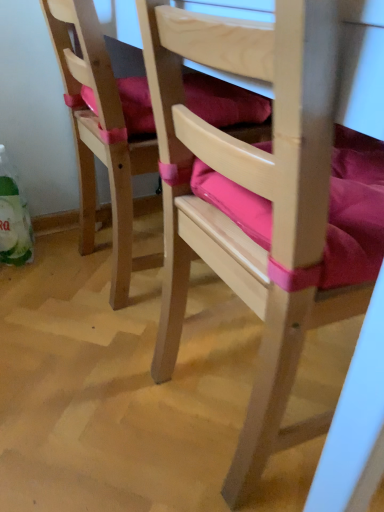
Question: Can you confirm if pink fabric cushion at left, which ranks as the second chair in right-to-left order, is smaller than wooden chair with pink cushion at center, arranged as the 1th chair when viewed from the right?

Choices:
 (A) yes
 (B) no

Answer: (A)

Question: Would you say wooden chair with pink cushion at center, arranged as the 1th chair when viewed from the right, is part of pink fabric cushion at left, which ranks as the second chair in right-to-left order,'s contents?

Choices:
 (A) yes
 (B) no

Answer: (B)

Question: Does pink fabric cushion at left, which ranks as the second chair in right-to-left order, have a lesser height compared to wooden chair with pink cushion at center, arranged as the 1th chair when viewed from the right?

Choices:
 (A) yes
 (B) no

Answer: (A)

Question: Does pink fabric cushion at left, which ranks as the second chair in right-to-left order, have a greater height compared to wooden chair with pink cushion at center, arranged as the 1th chair when viewed from the right?

Choices:
 (A) no
 (B) yes

Answer: (A)

Question: Considering the relative positions of pink fabric cushion at left, which is the 1th chair in left-to-right order, and wooden chair with pink cushion at center, arranged as the 1th chair when viewed from the right, in the image provided, is pink fabric cushion at left, which is the 1th chair in left-to-right order, behind wooden chair with pink cushion at center, arranged as the 1th chair when viewed from the right,?

Choices:
 (A) no
 (B) yes

Answer: (B)

Question: Is pink fabric cushion at left, which ranks as the second chair in right-to-left order, next to wooden chair with pink cushion at center, the second chair in the left-to-right sequence, and touching it?

Choices:
 (A) no
 (B) yes

Answer: (A)

Question: Is wooden chair with pink cushion at center, the second chair in the left-to-right sequence, aimed at pink fabric cushion at left, which ranks as the second chair in right-to-left order?

Choices:
 (A) yes
 (B) no

Answer: (B)

Question: Considering the relative sizes of wooden chair with pink cushion at center, the second chair in the left-to-right sequence, and pink fabric cushion at left, which ranks as the second chair in right-to-left order, in the image provided, is wooden chair with pink cushion at center, the second chair in the left-to-right sequence, taller than pink fabric cushion at left, which ranks as the second chair in right-to-left order,?

Choices:
 (A) yes
 (B) no

Answer: (A)

Question: From the image's perspective, is wooden chair with pink cushion at center, arranged as the 1th chair when viewed from the right, located beneath pink fabric cushion at left, which is the 1th chair in left-to-right order?

Choices:
 (A) yes
 (B) no

Answer: (A)

Question: Does wooden chair with pink cushion at center, the second chair in the left-to-right sequence, come in front of pink fabric cushion at left, which is the 1th chair in left-to-right order?

Choices:
 (A) yes
 (B) no

Answer: (A)

Question: Considering the relative sizes of wooden chair with pink cushion at center, the second chair in the left-to-right sequence, and pink fabric cushion at left, which is the 1th chair in left-to-right order, in the image provided, is wooden chair with pink cushion at center, the second chair in the left-to-right sequence, shorter than pink fabric cushion at left, which is the 1th chair in left-to-right order,?

Choices:
 (A) yes
 (B) no

Answer: (B)

Question: Is wooden chair with pink cushion at center, the second chair in the left-to-right sequence, to the left of pink fabric cushion at left, which is the 1th chair in left-to-right order, from the viewer's perspective?

Choices:
 (A) no
 (B) yes

Answer: (A)

Question: In terms of width, does wooden chair with pink cushion at center, arranged as the 1th chair when viewed from the right, look wider or thinner when compared to pink fabric cushion at left, which is the 1th chair in left-to-right order?

Choices:
 (A) thin
 (B) wide

Answer: (B)